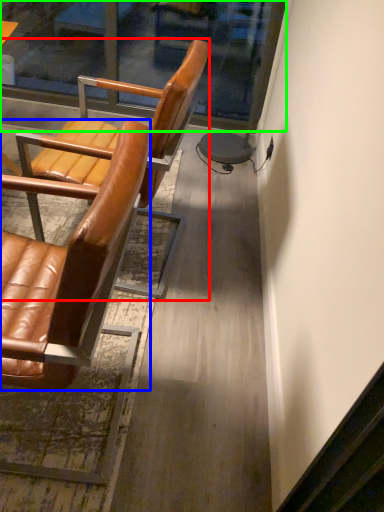
Question: Which is nearer to the chair (highlighted by a red box)? chair (highlighted by a blue box) or glass door (highlighted by a green box).

Choices:
 (A) chair
 (B) glass door

Answer: (A)